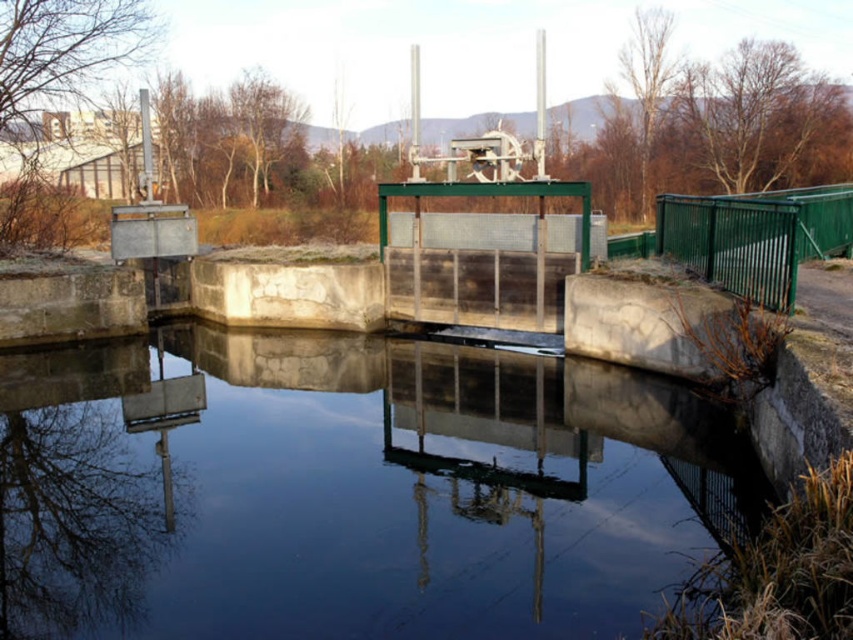
Question: From the image, what is the correct spatial relationship of transparent water at center in relation to green metallic fence at right?

Choices:
 (A) below
 (B) above

Answer: (A)

Question: Can you confirm if transparent water at center is wider than green metallic fence at right?

Choices:
 (A) yes
 (B) no

Answer: (A)

Question: Is transparent water at center bigger than green metallic fence at right?

Choices:
 (A) no
 (B) yes

Answer: (A)

Question: Which point is closer to the camera?

Choices:
 (A) green metallic fence at right
 (B) transparent water at center

Answer: (B)